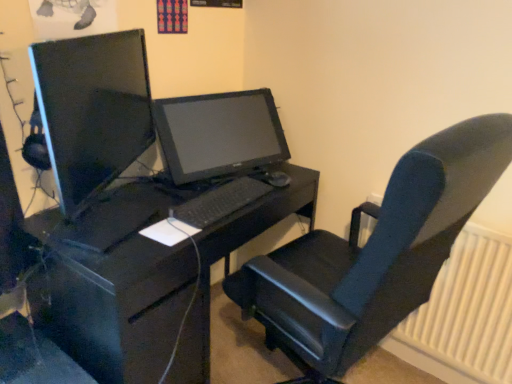
This screenshot has height=384, width=512. In order to click on vacant point above black matte desk at center (from a real-world perspective) in this screenshot , I will do `click(163, 204)`.